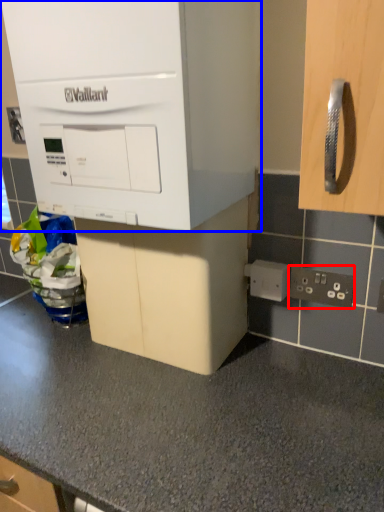
Question: Among these objects, which one is farthest to the camera, electric outlet (highlighted by a red box) or cabinetry (highlighted by a blue box)?

Choices:
 (A) electric outlet
 (B) cabinetry

Answer: (A)